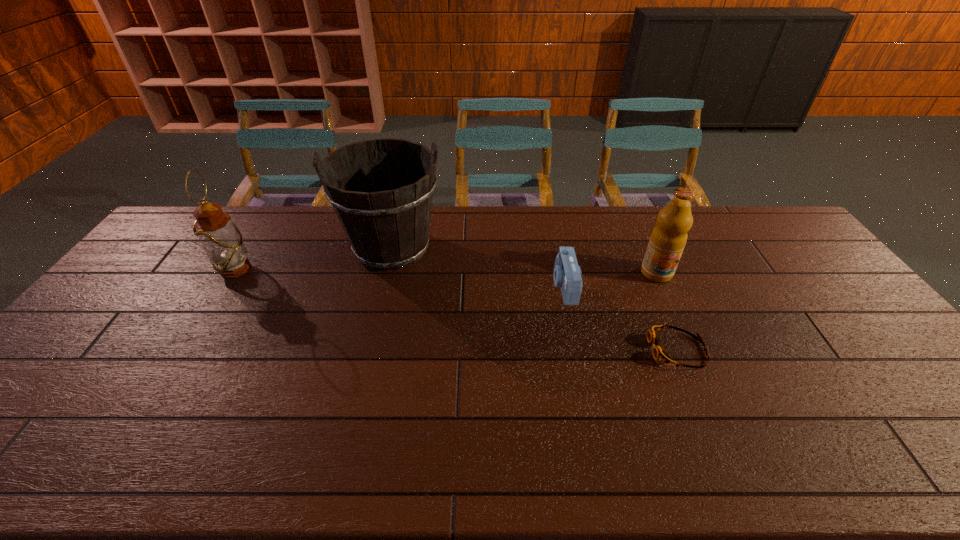
Locate an element on the screen. This screenshot has width=960, height=540. vacant space at the right edge of the desktop is located at coordinates (861, 327).

Find the location of `vacant space at the far left corner`. vacant space at the far left corner is located at coordinates (165, 244).

I want to click on free area in between the bucket and the third object from left to right, so click(478, 267).

At what (x,y) coordinates should I click in order to perform the action: click on free space between the nearest object and the fruit juice. Please return your answer as a coordinate pair (x, y). Looking at the image, I should click on (667, 312).

At what (x,y) coordinates should I click in order to perform the action: click on free space between the fruit juice and the oil lamp. Please return your answer as a coordinate pair (x, y). Looking at the image, I should click on (446, 271).

Where is `vacant area that lies between the third shortest object and the second shortest object`? vacant area that lies between the third shortest object and the second shortest object is located at coordinates (611, 279).

The width and height of the screenshot is (960, 540). Identify the location of vacant space that is in between the oil lamp and the bucket. (314, 259).

I want to click on free spot between the leftmost object and the fruit juice, so [446, 271].

Locate an element on the screen. unoccupied area between the oil lamp and the shortest object is located at coordinates (457, 310).

At what (x,y) coordinates should I click in order to perform the action: click on vacant area that lies between the leftmost object and the fruit juice. Please return your answer as a coordinate pair (x, y). Looking at the image, I should click on (446, 271).